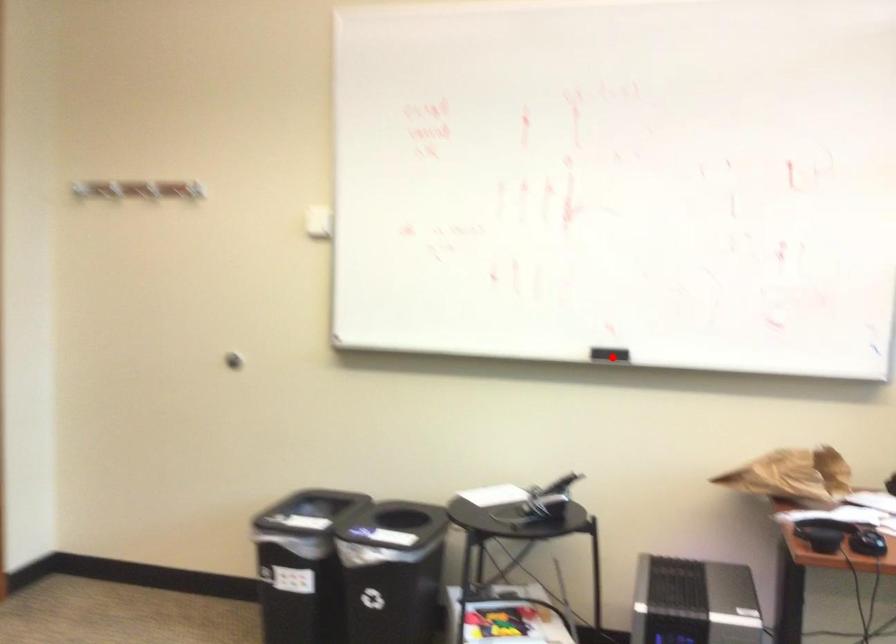
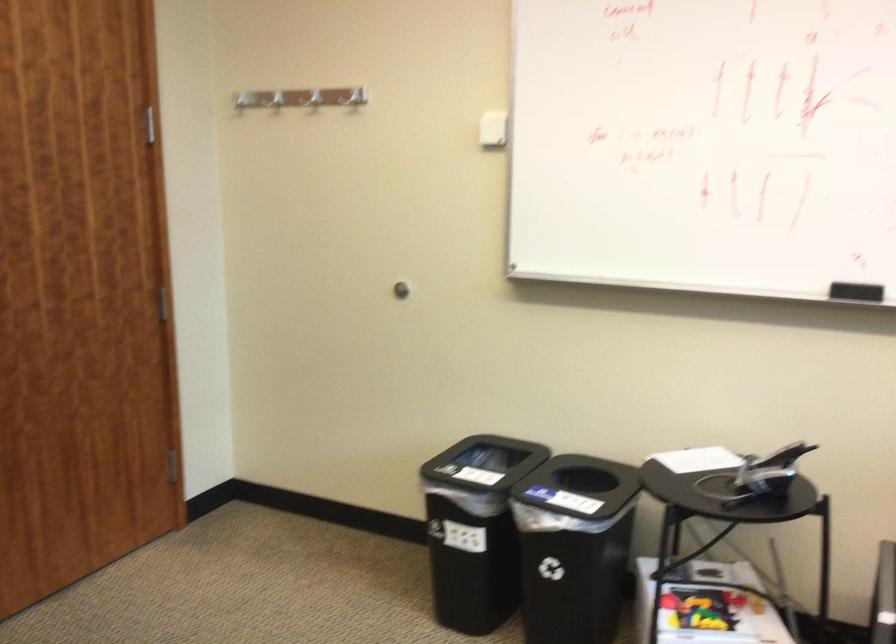
In the second image, find the point that corresponds to the highlighted location in the first image.

(856, 292)